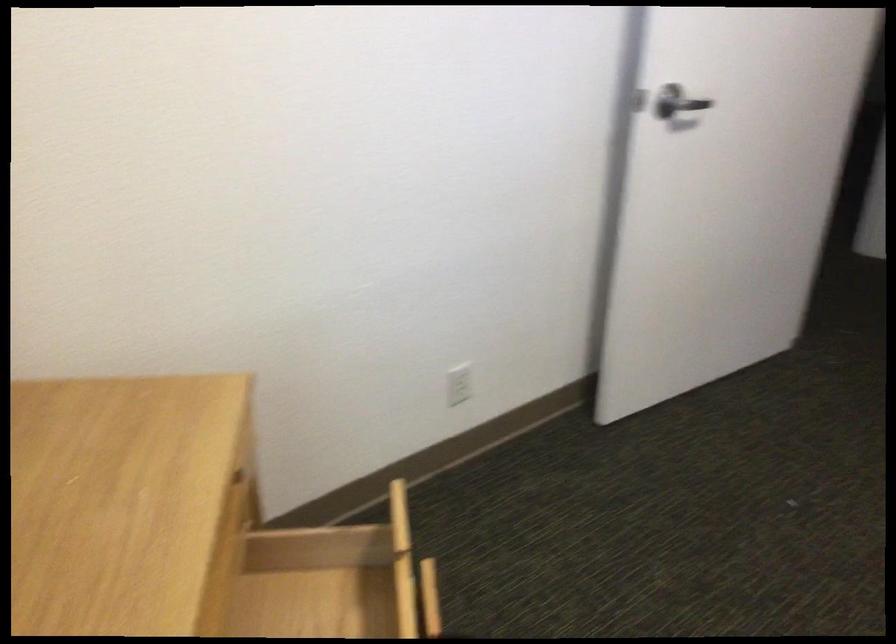
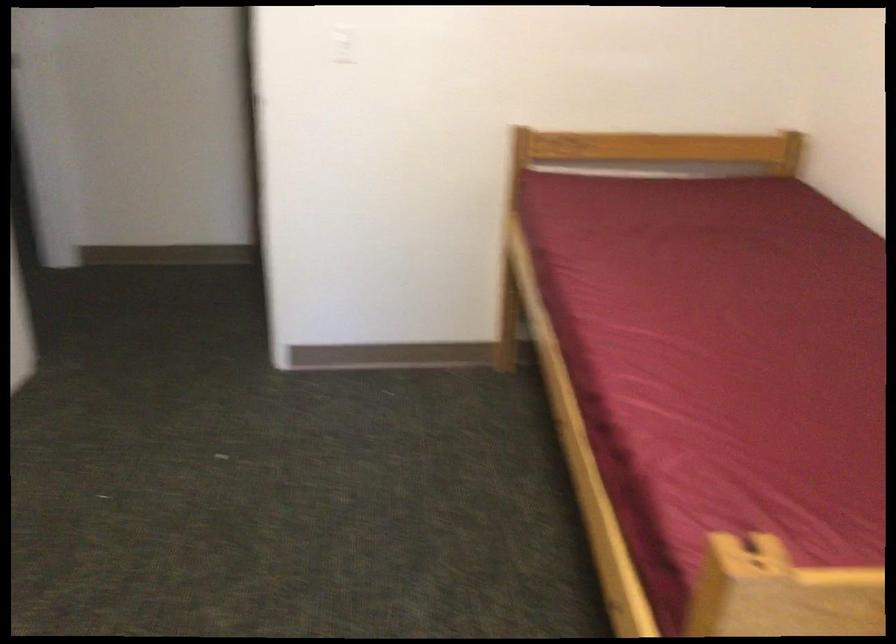
Question: The images are taken continuously from a first-person perspective. In which direction is your viewpoint rotating?

Choices:
 (A) Left
 (B) Right
 (C) Up
 (D) Down

Answer: (B)